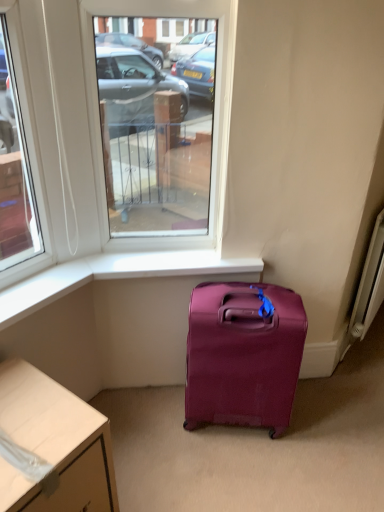
Question: Could matte purple suitcase at lower center be considered to be inside white glossy desk at lower left?

Choices:
 (A) yes
 (B) no

Answer: (B)

Question: Does white glossy desk at lower left have a greater height compared to matte purple suitcase at lower center?

Choices:
 (A) no
 (B) yes

Answer: (A)

Question: Does white glossy desk at lower left touch matte purple suitcase at lower center?

Choices:
 (A) yes
 (B) no

Answer: (B)

Question: Is white glossy desk at lower left shorter than matte purple suitcase at lower center?

Choices:
 (A) no
 (B) yes

Answer: (B)

Question: Is white glossy desk at lower left facing away from matte purple suitcase at lower center?

Choices:
 (A) no
 (B) yes

Answer: (A)

Question: Considering the positions of clear glass window at center and white glossy desk at lower left in the image, is clear glass window at center taller or shorter than white glossy desk at lower left?

Choices:
 (A) short
 (B) tall

Answer: (B)

Question: Considering their positions, is clear glass window at center located in front of or behind white glossy desk at lower left?

Choices:
 (A) front
 (B) behind

Answer: (B)

Question: From a real-world perspective, is clear glass window at center physically located above or below white glossy desk at lower left?

Choices:
 (A) above
 (B) below

Answer: (A)

Question: Looking at their shapes, would you say clear glass window at center is wider or thinner than white glossy desk at lower left?

Choices:
 (A) wide
 (B) thin

Answer: (B)

Question: Which is correct: white glossy desk at lower left is inside clear glass window at center, or outside of it?

Choices:
 (A) outside
 (B) inside

Answer: (A)

Question: Based on their sizes in the image, would you say white glossy desk at lower left is bigger or smaller than clear glass window at center?

Choices:
 (A) big
 (B) small

Answer: (A)

Question: Is white glossy desk at lower left in front of or behind clear glass window at center in the image?

Choices:
 (A) behind
 (B) front

Answer: (B)

Question: Is white glossy desk at lower left taller or shorter than clear glass window at center?

Choices:
 (A) short
 (B) tall

Answer: (A)

Question: In the image, is matte purple suitcase at lower center positioned in front of or behind white glossy desk at lower left?

Choices:
 (A) behind
 (B) front

Answer: (A)

Question: Is matte purple suitcase at lower center wider or thinner than white glossy desk at lower left?

Choices:
 (A) thin
 (B) wide

Answer: (A)